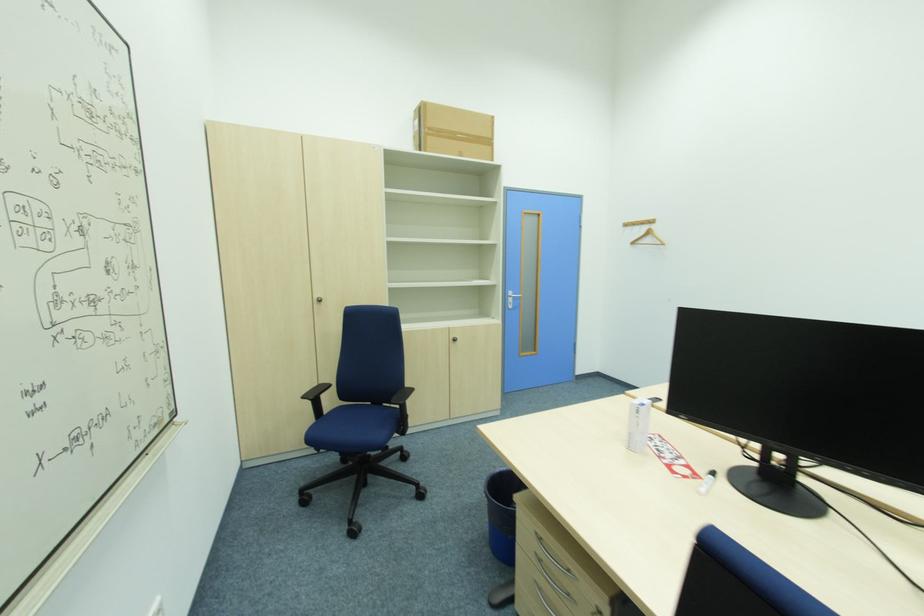
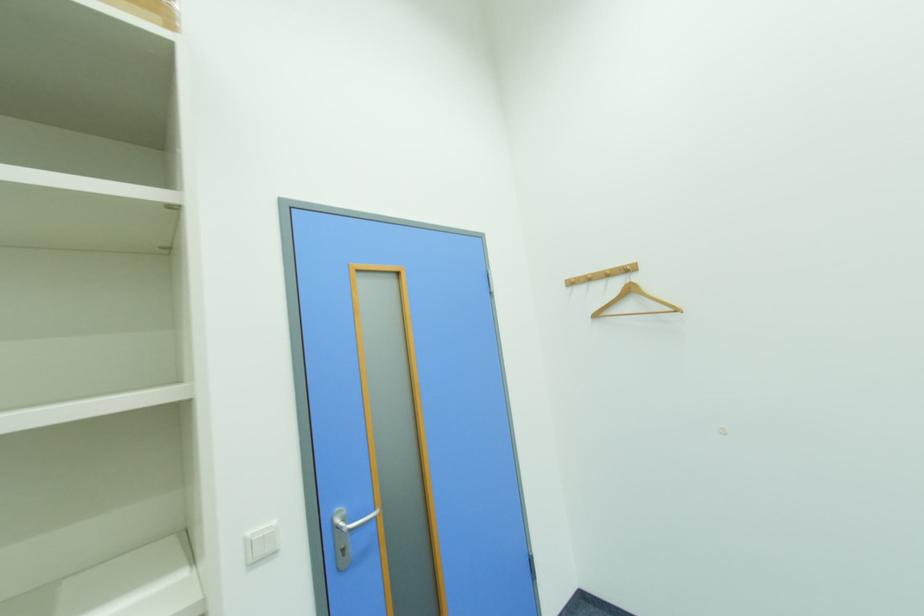
Locate, in the second image, the point that corresponds to point (638, 245) in the first image.

(601, 317)